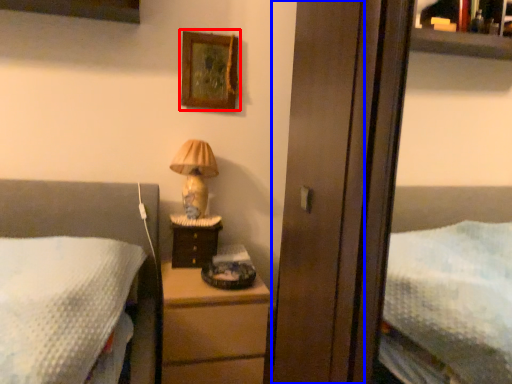
Question: Which object is further to the camera taking this photo, picture frame (highlighted by a red box) or screen door (highlighted by a blue box)?

Choices:
 (A) picture frame
 (B) screen door

Answer: (A)